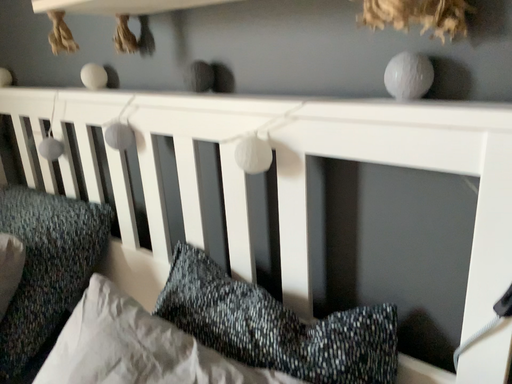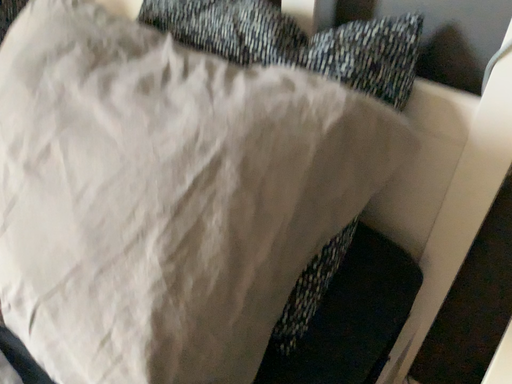
Question: How did the camera likely rotate when shooting the video?

Choices:
 (A) rotated downward
 (B) rotated upward

Answer: (A)